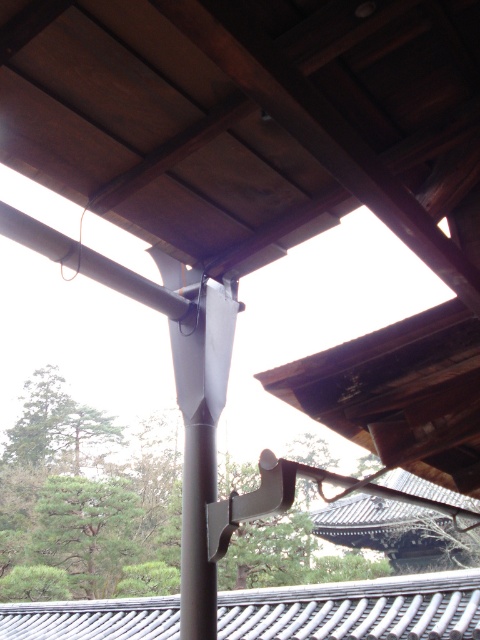
Between point (395, 65) and point (342, 616), which one is positioned behind?

The point (342, 616) is behind.

Can you confirm if dark brown wood at center is positioned to the left of gray tile roof at lower center?

Indeed, dark brown wood at center is positioned on the left side of gray tile roof at lower center.

This screenshot has height=640, width=480. Identify the location of dark brown wood at center. (252, 122).